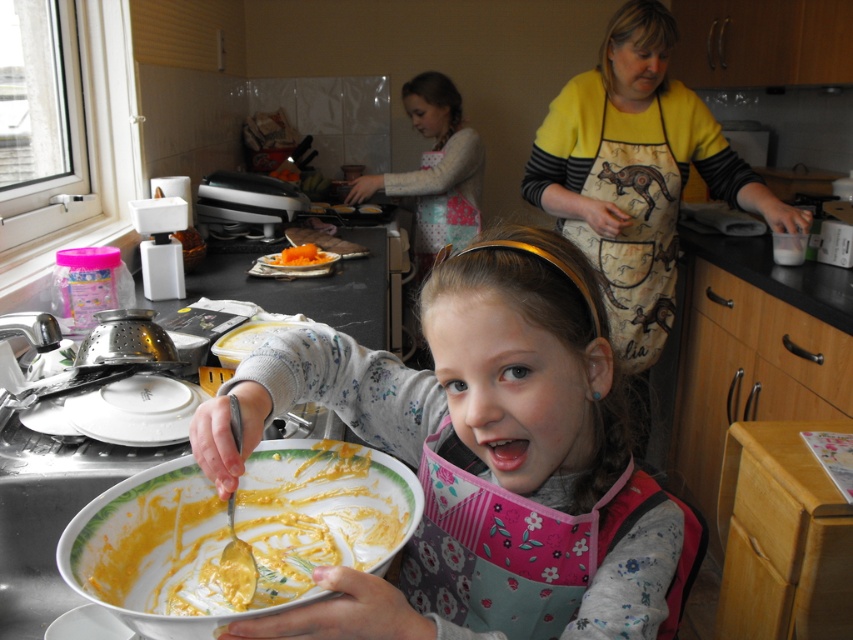
Is white matte plastic container at upper right positioned before orange smoothie at center?

Yes.

Between point (616, 38) and point (322, 257), which one is positioned in front?

Point (616, 38) is in front.

The image size is (853, 640). I want to click on white matte plastic container at upper right, so click(x=637, y=176).

The width and height of the screenshot is (853, 640). What are the coordinates of `matte white bowl at center` in the screenshot? It's located at (480, 456).

The width and height of the screenshot is (853, 640). Describe the element at coordinates (480, 456) in the screenshot. I see `matte white bowl at center` at that location.

Where is `matte white bowl at center`? This screenshot has width=853, height=640. matte white bowl at center is located at coordinates (480, 456).

In order to click on matte white bowl at center in this screenshot , I will do `click(480, 456)`.

Can you confirm if white glossy bowl at lower center is positioned above orange smoothie at center?

Actually, white glossy bowl at lower center is below orange smoothie at center.

Does white glossy bowl at lower center come behind orange smoothie at center?

No, white glossy bowl at lower center is in front of orange smoothie at center.

Which is behind, point (292, 520) or point (305, 253)?

The point (305, 253) is behind.

Where is `white glossy bowl at lower center`? This screenshot has width=853, height=640. white glossy bowl at lower center is located at coordinates (236, 532).